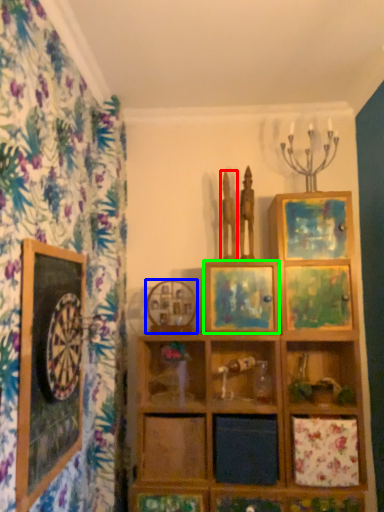
Question: Which object is the farthest from sculpture (highlighted by a red box)? Choose among these: picture frame (highlighted by a blue box) or picture frame (highlighted by a green box).

Choices:
 (A) picture frame
 (B) picture frame

Answer: (A)